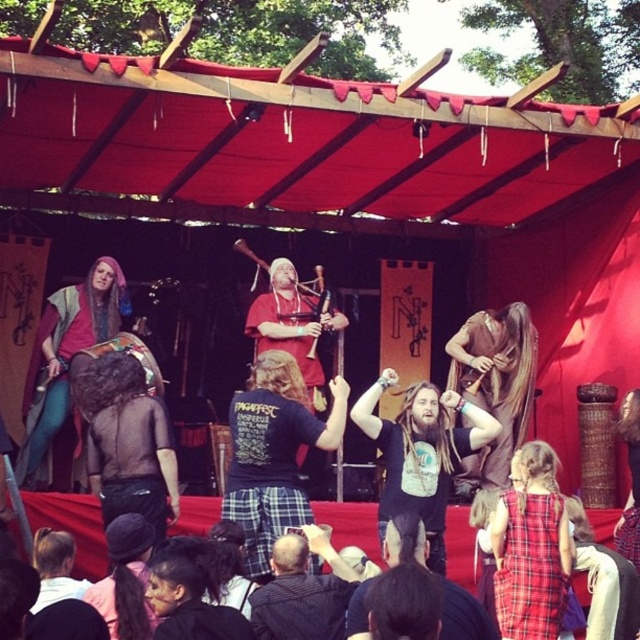
Is brown textured shirt at center to the left of plaid fabric dress at lower right from the viewer's perspective?

Yes, brown textured shirt at center is to the left of plaid fabric dress at lower right.

Describe the element at coordinates (420, 452) in the screenshot. The image size is (640, 640). I see `brown textured shirt at center` at that location.

This screenshot has height=640, width=640. Find the location of `brown textured shirt at center`. brown textured shirt at center is located at coordinates (420, 452).

Which is in front, point (136, 500) or point (284, 563)?

Point (284, 563) is more forward.

Looking at this image, is black leather pants at lower left wider than dark gray plaid shirt at center?

Yes, black leather pants at lower left is wider than dark gray plaid shirt at center.

Where is `black leather pants at lower left`? The image size is (640, 640). black leather pants at lower left is located at coordinates pyautogui.click(x=128, y=442).

Where is `black leather pants at lower left`? This screenshot has width=640, height=640. black leather pants at lower left is located at coordinates (128, 442).

Based on the photo, can you confirm if black cotton t-shirt at center is taller than plaid fabric dress at lower right?

Yes.

Can you confirm if black cotton t-shirt at center is thinner than plaid fabric dress at lower right?

In fact, black cotton t-shirt at center might be wider than plaid fabric dress at lower right.

This screenshot has height=640, width=640. What do you see at coordinates (275, 452) in the screenshot? I see `black cotton t-shirt at center` at bounding box center [275, 452].

Locate an element on the screen. black cotton t-shirt at center is located at coordinates (275, 452).